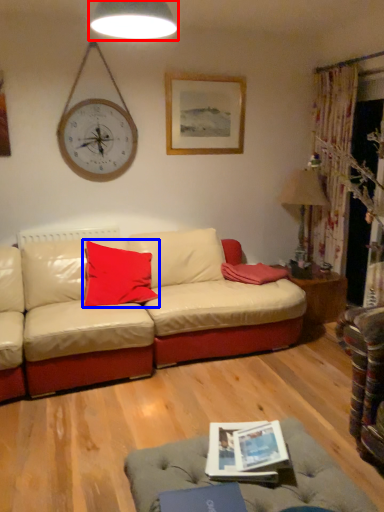
Question: Which point is closer to the camera, lamp (highlighted by a red box) or pillow (highlighted by a blue box)?

Choices:
 (A) lamp
 (B) pillow

Answer: (A)